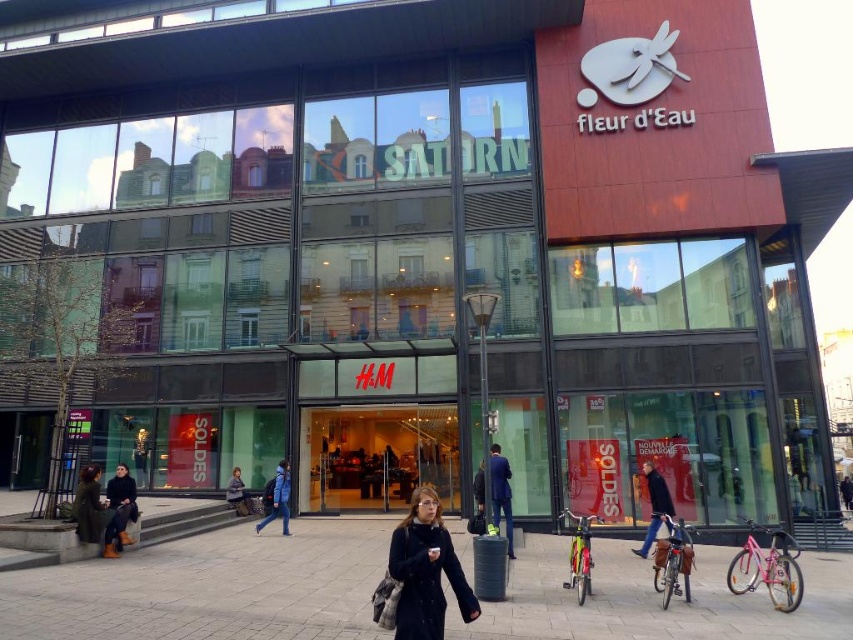
Between dark blue jeans at center and dark gray coat at lower center, which one has less height?

With less height is dark gray coat at lower center.

Is dark blue jeans at center taller than dark gray coat at lower center?

Indeed, dark blue jeans at center has a greater height compared to dark gray coat at lower center.

Is point (654, 484) positioned behind point (234, 477)?

That is False.

You are a GUI agent. You are given a task and a screenshot of the screen. Output one action in this format:
    pyautogui.click(x=<x>, y=<y>)
    Task: Click on the dark blue jeans at center
    The height and width of the screenshot is (640, 853).
    Given the screenshot: What is the action you would take?
    pyautogui.click(x=654, y=506)

Is point (404, 536) in front of point (271, 512)?

Yes, it is.

Can you confirm if black matte coat at center is positioned above blue fabric jacket at center?

Correct, black matte coat at center is located above blue fabric jacket at center.

Between point (418, 593) and point (282, 492), which one is positioned behind?

Positioned behind is point (282, 492).

At what (x,y) coordinates should I click in order to perform the action: click on black matte coat at center. Please return your answer as a coordinate pair (x, y). The height and width of the screenshot is (640, 853). Looking at the image, I should click on pyautogui.click(x=425, y=570).

Can you confirm if leather boots at lower left is bigger than blue fabric jacket at center?

Incorrect, leather boots at lower left is not larger than blue fabric jacket at center.

Is leather boots at lower left shorter than blue fabric jacket at center?

Correct, leather boots at lower left is not as tall as blue fabric jacket at center.

At what (x,y) coordinates should I click in order to perform the action: click on leather boots at lower left. Please return your answer as a coordinate pair (x, y). The image size is (853, 640). Looking at the image, I should click on (120, 506).

This screenshot has width=853, height=640. Identify the location of leather boots at lower left. (120, 506).